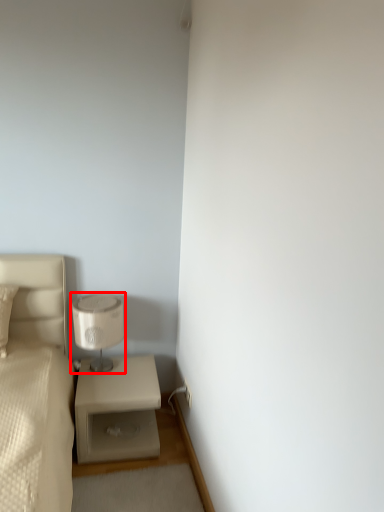
Question: From the image's perspective, where is table lamp (annotated by the red box) located in relation to nightstand in the image?

Choices:
 (A) above
 (B) below

Answer: (A)